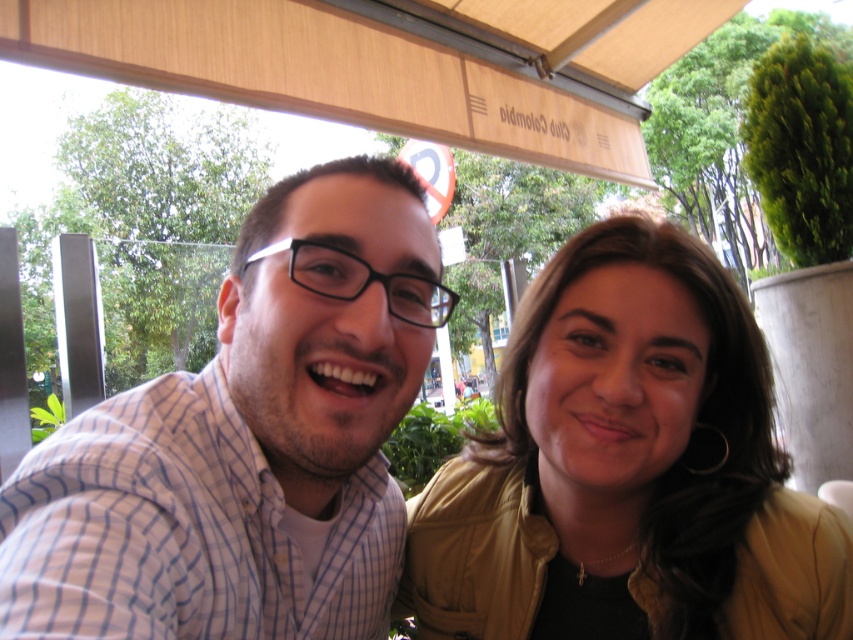
Question: Does checkered fabric shirt at center come behind matte gold jacket at center?

Choices:
 (A) no
 (B) yes

Answer: (A)

Question: Which point is farther to the camera?

Choices:
 (A) (772, 444)
 (B) (343, 611)

Answer: (A)

Question: Is checkered fabric shirt at center positioned at the back of matte gold jacket at center?

Choices:
 (A) yes
 (B) no

Answer: (B)

Question: Which point is closer to the camera taking this photo?

Choices:
 (A) (218, 624)
 (B) (726, 534)

Answer: (A)

Question: Which of the following is the closest to the observer?

Choices:
 (A) (334, 220)
 (B) (561, 605)

Answer: (A)

Question: Does checkered fabric shirt at center have a smaller size compared to matte gold jacket at center?

Choices:
 (A) yes
 (B) no

Answer: (B)